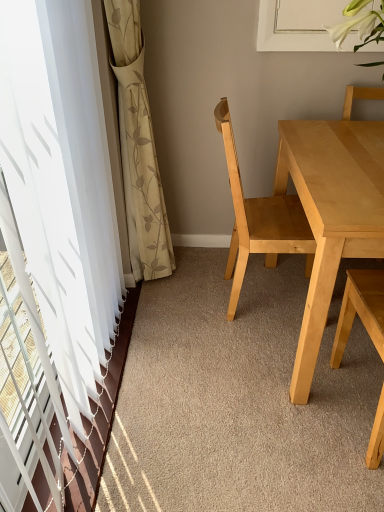
The height and width of the screenshot is (512, 384). I want to click on vacant space underneath beige floral fabric curtain at left (from a real-world perspective), so click(158, 293).